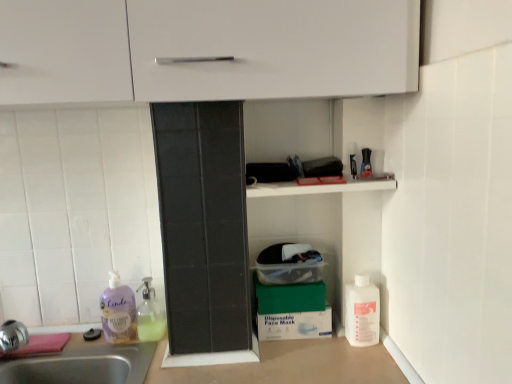
Question: Is green cardboard box at lower center to the left of white plastic bottle at lower right, which appears as the 3th cleaning product when viewed from the left, from the viewer's perspective?

Choices:
 (A) yes
 (B) no

Answer: (A)

Question: Is green cardboard box at lower center directly adjacent to white plastic bottle at lower right, which appears as the 3th cleaning product when viewed from the left?

Choices:
 (A) yes
 (B) no

Answer: (B)

Question: Is green cardboard box at lower center looking in the opposite direction of white plastic bottle at lower right, the 1th cleaning product from the right?

Choices:
 (A) no
 (B) yes

Answer: (A)

Question: Can you confirm if green cardboard box at lower center is smaller than white plastic bottle at lower right, which appears as the 3th cleaning product when viewed from the left?

Choices:
 (A) yes
 (B) no

Answer: (B)

Question: Can you confirm if green cardboard box at lower center is positioned to the right of white plastic bottle at lower right, which appears as the 3th cleaning product when viewed from the left?

Choices:
 (A) no
 (B) yes

Answer: (A)

Question: Considering the relative sizes of green cardboard box at lower center and white plastic bottle at lower right, the 1th cleaning product from the right, in the image provided, is green cardboard box at lower center taller than white plastic bottle at lower right, the 1th cleaning product from the right,?

Choices:
 (A) yes
 (B) no

Answer: (B)

Question: Is translucent glass soap dispenser at lower left, the second cleaning product viewed from the left, facing away from green cardboard box at lower center?

Choices:
 (A) yes
 (B) no

Answer: (B)

Question: Considering the relative sizes of translucent glass soap dispenser at lower left, the second cleaning product viewed from the left, and green cardboard box at lower center in the image provided, is translucent glass soap dispenser at lower left, the second cleaning product viewed from the left, wider than green cardboard box at lower center?

Choices:
 (A) no
 (B) yes

Answer: (B)

Question: Is translucent glass soap dispenser at lower left, the second cleaning product viewed from the left, to the right of green cardboard box at lower center from the viewer's perspective?

Choices:
 (A) yes
 (B) no

Answer: (B)

Question: Does translucent glass soap dispenser at lower left, marked as the 2th cleaning product in a right-to-left arrangement, touch green cardboard box at lower center?

Choices:
 (A) yes
 (B) no

Answer: (B)

Question: From a real-world perspective, is translucent glass soap dispenser at lower left, the second cleaning product viewed from the left, below green cardboard box at lower center?

Choices:
 (A) no
 (B) yes

Answer: (A)

Question: Is translucent glass soap dispenser at lower left, marked as the 2th cleaning product in a right-to-left arrangement, not inside green cardboard box at lower center?

Choices:
 (A) no
 (B) yes

Answer: (B)

Question: Does translucent glass soap dispenser at lower left, the second cleaning product viewed from the left, have a lesser width compared to green matte box at lower center?

Choices:
 (A) yes
 (B) no

Answer: (B)